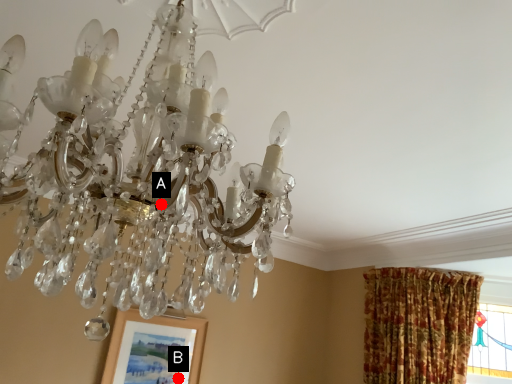
Question: Two points are circled on the image, labeled by A and B beside each circle. Which point is further to the camera?

Choices:
 (A) A is further
 (B) B is further

Answer: (B)